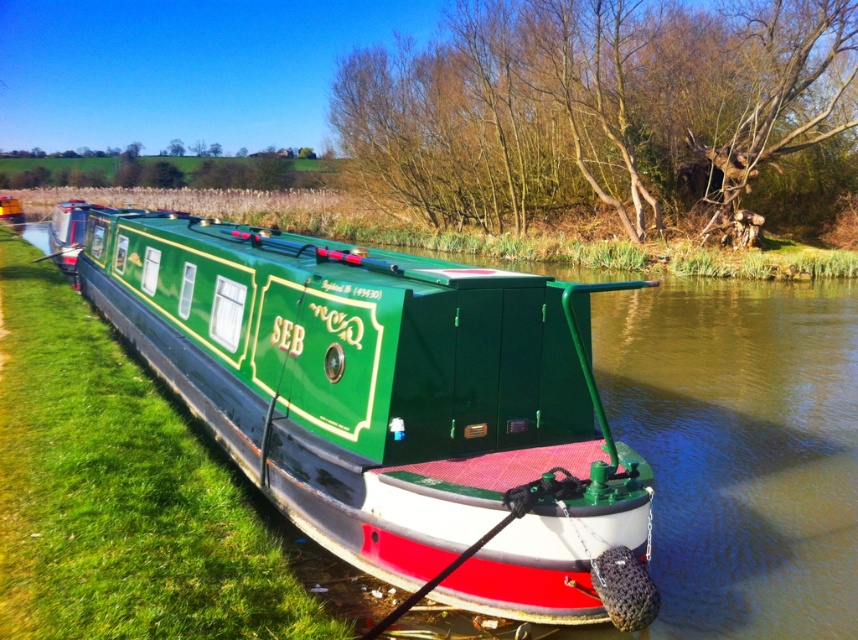
You are standing on the grassy bank of the canal next to the green glossy canal boat at center. You want to throw a lifebuoy to someone on the boat. The lifebuoy can travel 4 meters. Will it reach the boat?

The distance of green glossy canal boat at center from viewer is 3.98 meters, so yes, the lifebuoy can reach the boat since it can travel 4 meters.

You are standing on the grassy bank of the canal. You see the green glossy canal boat at center and the green grass at left. Which object is closer to your right side?

The green glossy canal boat at center is to the right of green grass at left, so the green glossy canal boat at center is closer to your right side.

You are standing on the grassy bank of the canal. You want to board the green glossy canal boat at center. Which direction should you move relative to the green grass at left to reach the boat?

The green glossy canal boat at center is above the green grass at left, so you should move upward from the green grass at left to reach the boat.